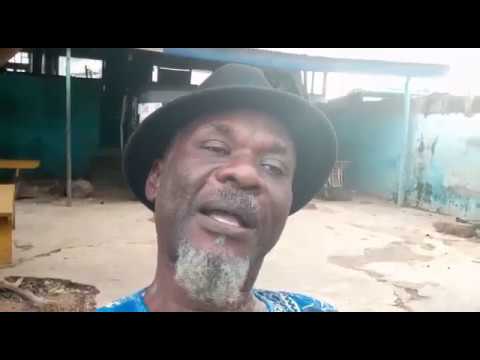
Identify the location of wall. The width and height of the screenshot is (480, 360). (401, 150).